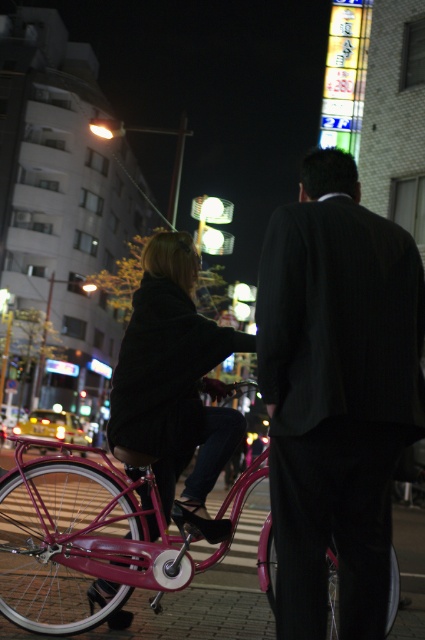
Question: Among these objects, which one is nearest to the camera?

Choices:
 (A) shiny pink bicycle at center
 (B) matte black coat at center

Answer: (A)

Question: Is shiny pink bicycle at center in front of matte black coat at center?

Choices:
 (A) yes
 (B) no

Answer: (A)

Question: In this image, where is shiny pink bicycle at center located relative to matte black coat at center?

Choices:
 (A) right
 (B) left

Answer: (B)

Question: Which point is closer to the camera?

Choices:
 (A) (153, 364)
 (B) (130, 493)
 (C) (380, 609)

Answer: (C)

Question: Which of the following is the closest to the observer?

Choices:
 (A) (45, 445)
 (B) (144, 452)
 (C) (292, 420)

Answer: (C)

Question: Is dark pinstripe suit at center to the right of shiny pink bicycle at center from the viewer's perspective?

Choices:
 (A) no
 (B) yes

Answer: (B)